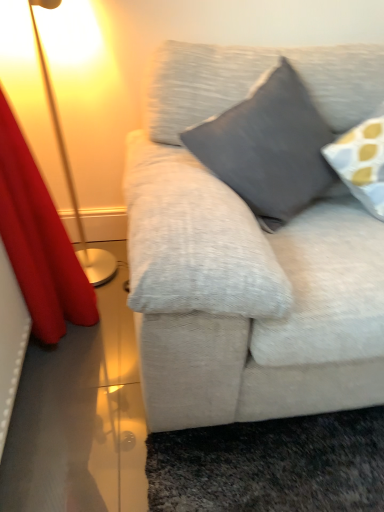
Locate an element on the screen. The image size is (384, 512). vacant space in red velvet curtain at left (from a real-world perspective) is located at coordinates (69, 352).